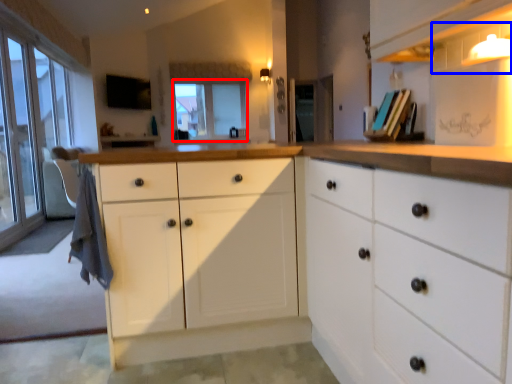
Question: Which point is further to the camera, window screen (highlighted by a red box) or shelf (highlighted by a blue box)?

Choices:
 (A) window screen
 (B) shelf

Answer: (A)